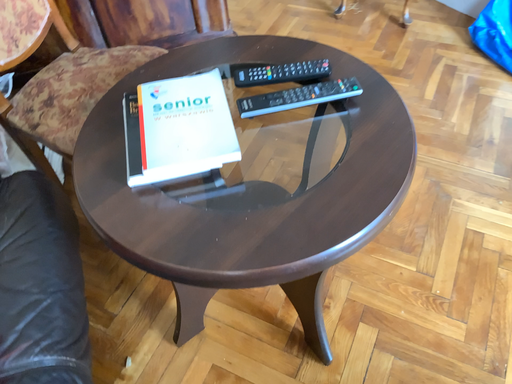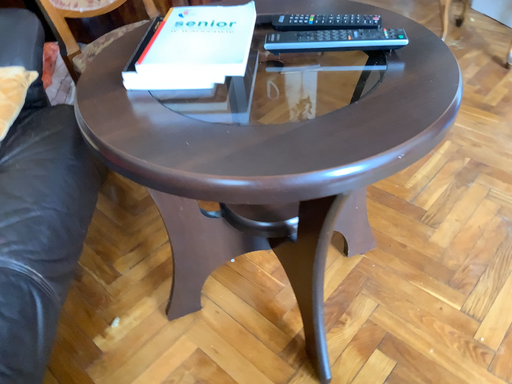
Question: How did the camera likely rotate when shooting the video?

Choices:
 (A) rotated downward
 (B) rotated upward

Answer: (B)